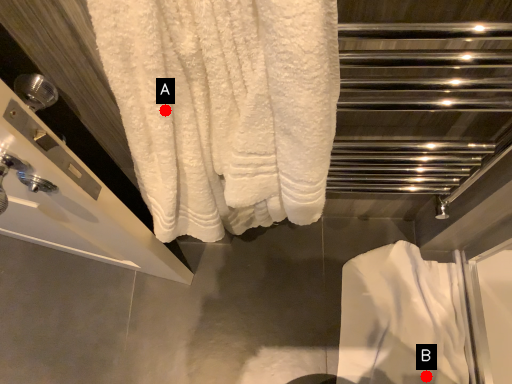
Question: Two points are circled on the image, labeled by A and B beside each circle. Among these points, which one is farthest from the camera?

Choices:
 (A) A is further
 (B) B is further

Answer: (B)